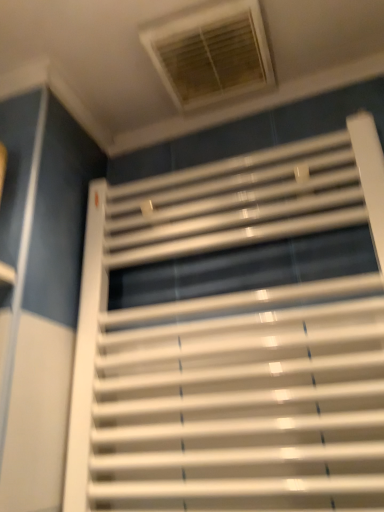
The height and width of the screenshot is (512, 384). What do you see at coordinates (244, 342) in the screenshot? I see `white glossy window blind at center` at bounding box center [244, 342].

Find the location of a particular element. white glossy window blind at center is located at coordinates (244, 342).

Locate an element on the screen. The image size is (384, 512). white plastic window at upper center is located at coordinates (211, 53).

Measure the distance between point (261,32) and camera.

Point (261,32) and camera are 26.38 inches apart.

This screenshot has width=384, height=512. Describe the element at coordinates (211, 53) in the screenshot. I see `white plastic window at upper center` at that location.

Locate an element on the screen. Image resolution: width=384 pixels, height=512 pixels. white glossy window blind at center is located at coordinates click(244, 342).

From the picture: Does white glossy window blind at center appear on the left side of white plastic window at upper center?

No.

Which object is further away from the camera taking this photo, white glossy window blind at center or white plastic window at upper center?

white plastic window at upper center.

Does point (368, 275) come farther from viewer compared to point (206, 92)?

No, (368, 275) is closer to viewer.

From the image's perspective, between white glossy window blind at center and white plastic window at upper center, which one is located above?

white plastic window at upper center appears higher in the image.

In the scene shown: From a real-world perspective, is white glossy window blind at center above or below white plastic window at upper center?

white glossy window blind at center is situated lower than white plastic window at upper center in the real world.

Is white glossy window blind at center wider or thinner than white plastic window at upper center?

Clearly, white glossy window blind at center has less width compared to white plastic window at upper center.

In the scene shown: Does white glossy window blind at center have a greater height compared to white plastic window at upper center?

Yes, white glossy window blind at center is taller than white plastic window at upper center.

Considering the sizes of white glossy window blind at center and white plastic window at upper center in the image, is white glossy window blind at center bigger or smaller than white plastic window at upper center?

white glossy window blind at center is bigger than white plastic window at upper center.

Is white glossy window blind at center not inside white plastic window at upper center?

That's correct, white glossy window blind at center is outside of white plastic window at upper center.

Based on the photo, is white glossy window blind at center far from white plastic window at upper center?

white glossy window blind at center is near white plastic window at upper center, not far away.

Consider the image. Is white glossy window blind at center looking in the opposite direction of white plastic window at upper center?

No, white glossy window blind at center is not facing away from white plastic window at upper center.

Locate an element on the screen. This screenshot has width=384, height=512. window blind below the white plastic window at upper center (from the image's perspective) is located at coordinates (244, 342).

Is white plastic window at upper center to the left or to the right of white glossy window blind at center in the image?

From the image, it's evident that white plastic window at upper center is to the left of white glossy window blind at center.

In the scene shown: Is white plastic window at upper center positioned before white glossy window blind at center?

No, white plastic window at upper center is further to the viewer.

Does point (166, 53) appear closer or farther from the camera than point (361, 191)?

Point (166, 53) is farther from the camera than point (361, 191).

From the image's perspective, is white plastic window at upper center beneath white glossy window blind at center?

No, from the image's perspective, white plastic window at upper center is not beneath white glossy window blind at center.

From a real-world perspective, who is located lower, white plastic window at upper center or white glossy window blind at center?

From a 3D spatial view, white glossy window blind at center is below.

Which of these two, white plastic window at upper center or white glossy window blind at center, is wider?

With larger width is white plastic window at upper center.

Considering the sizes of white plastic window at upper center and white glossy window blind at center in the image, is white plastic window at upper center taller or shorter than white glossy window blind at center?

In the image, white plastic window at upper center appears to be shorter than white glossy window blind at center.

Who is smaller, white plastic window at upper center or white glossy window blind at center?

white plastic window at upper center.

Which is correct: white plastic window at upper center is inside white glossy window blind at center, or outside of it?

white plastic window at upper center is located beyond the bounds of white glossy window blind at center.

Is white plastic window at upper center not close to white glossy window blind at center?

They are positioned close to each other.

Could you tell me if white plastic window at upper center is facing white glossy window blind at center?

No, white plastic window at upper center is not facing towards white glossy window blind at center.

You are a GUI agent. You are given a task and a screenshot of the screen. Output one action in this format:
    pyautogui.click(x=<x>, y=<y>)
    Task: Click on the window blind lying on the right of white plastic window at upper center
    This screenshot has width=384, height=512.
    Given the screenshot: What is the action you would take?
    pyautogui.click(x=244, y=342)

Where is `window blind in front of the white plastic window at upper center`? The width and height of the screenshot is (384, 512). window blind in front of the white plastic window at upper center is located at coordinates (244, 342).

Identify the location of window blind below the white plastic window at upper center (from the image's perspective). (244, 342).